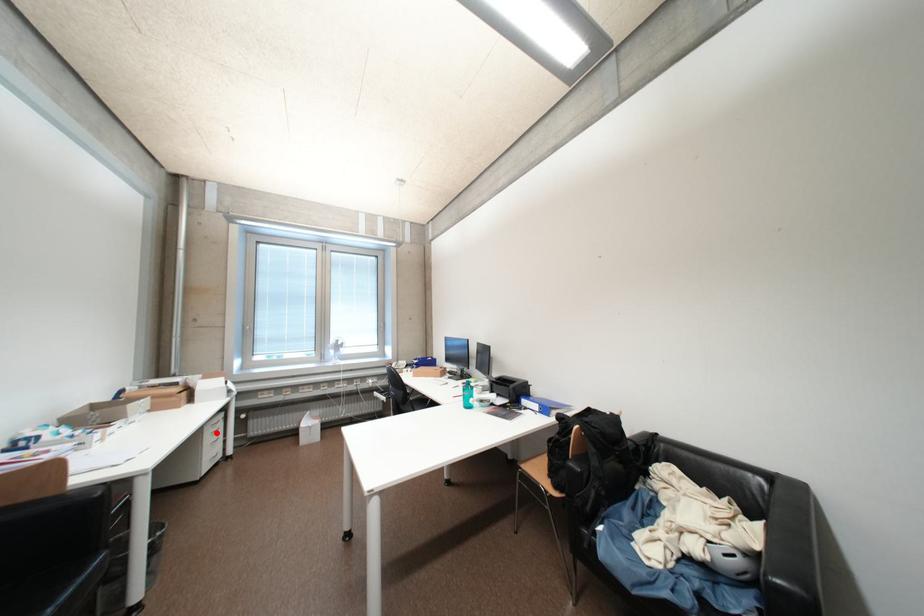
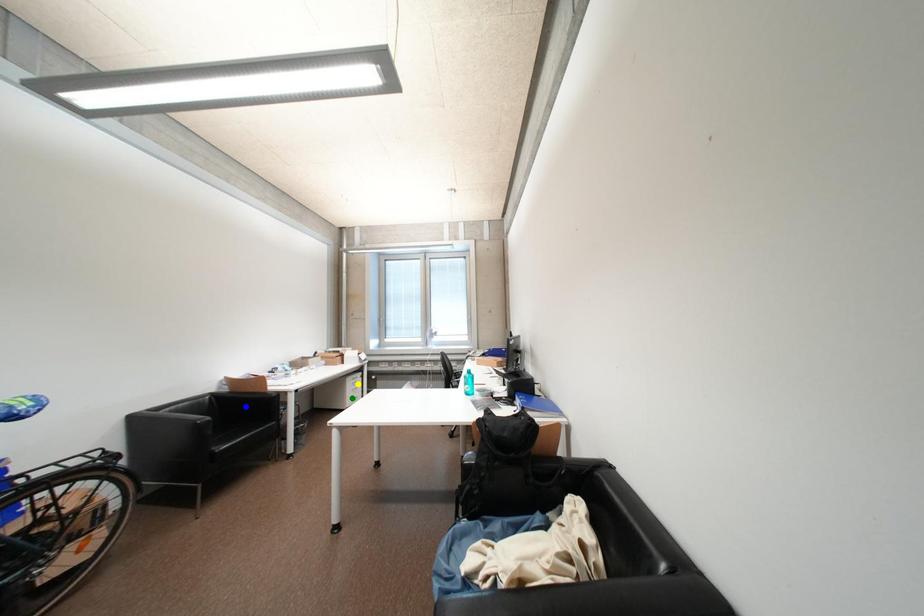
Question: I am providing you with two images of the same scene from different viewpoints. A red point is marked on the first image. You are given multiple points on the second image. Which point in image 2 represents the same 3d spot as the red point in image 1?

Choices:
 (A) blue point
 (B) green point
 (C) yellow point

Answer: (C)